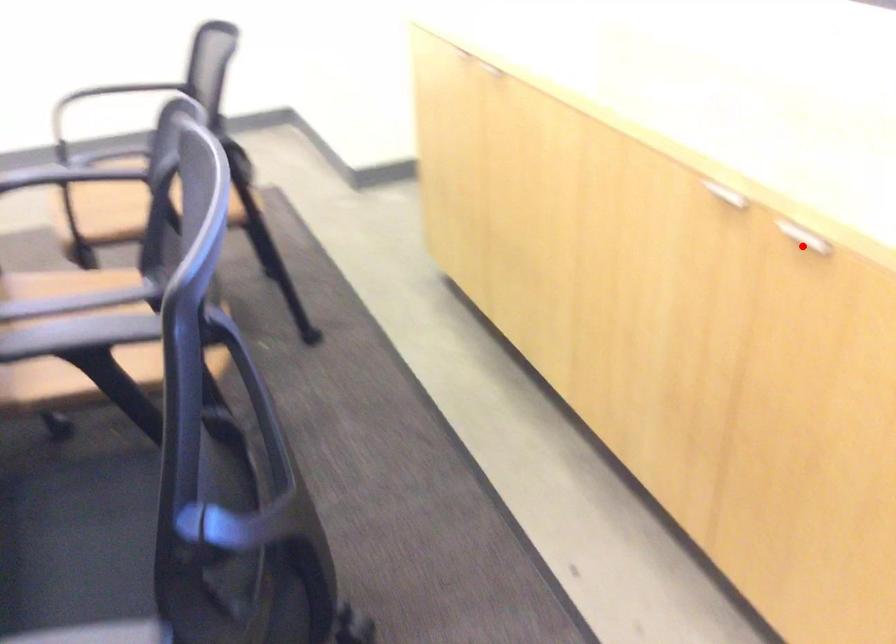
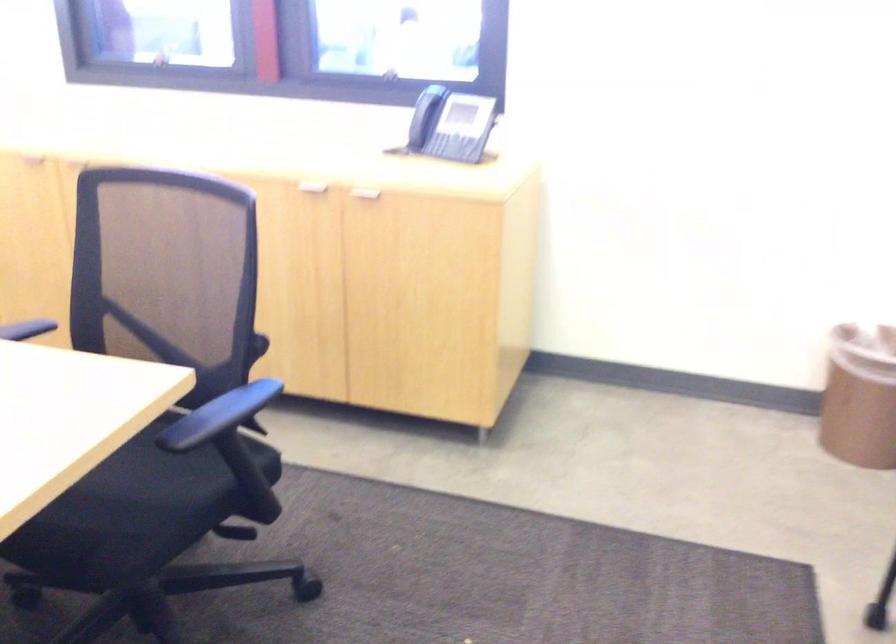
Find the pixel in the second image that matches the highlighted location in the first image.

(364, 196)